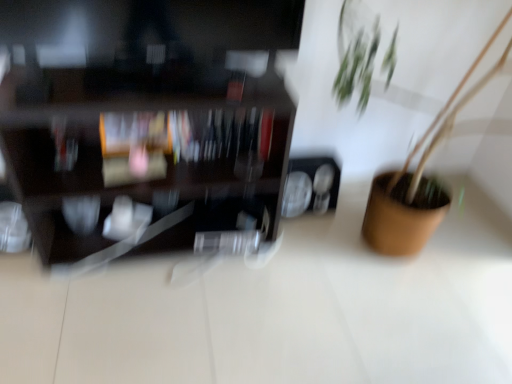
Question: Based on their positions, is dark wood shelf at left located to the left or right of brown matte pot at right?

Choices:
 (A) left
 (B) right

Answer: (A)

Question: From their relative heights in the image, would you say dark wood shelf at left is taller or shorter than brown matte pot at right?

Choices:
 (A) short
 (B) tall

Answer: (A)

Question: Considering the positions of dark wood shelf at left and brown matte pot at right in the image, is dark wood shelf at left wider or thinner than brown matte pot at right?

Choices:
 (A) thin
 (B) wide

Answer: (A)

Question: Considering their positions, is brown matte pot at right located in front of or behind dark wood shelf at left?

Choices:
 (A) behind
 (B) front

Answer: (B)

Question: Is point (458, 82) positioned closer to the camera than point (46, 89)?

Choices:
 (A) farther
 (B) closer

Answer: (A)

Question: Which is correct: brown matte pot at right is inside dark wood shelf at left, or outside of it?

Choices:
 (A) outside
 (B) inside

Answer: (A)

Question: In terms of height, does brown matte pot at right look taller or shorter compared to dark wood shelf at left?

Choices:
 (A) tall
 (B) short

Answer: (A)